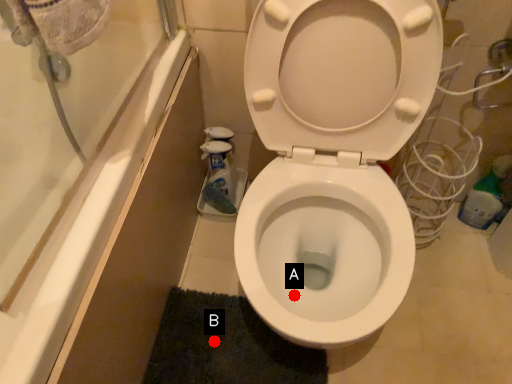
Question: Two points are circled on the image, labeled by A and B beside each circle. Among these points, which one is nearest to the camera?

Choices:
 (A) A is closer
 (B) B is closer

Answer: (A)